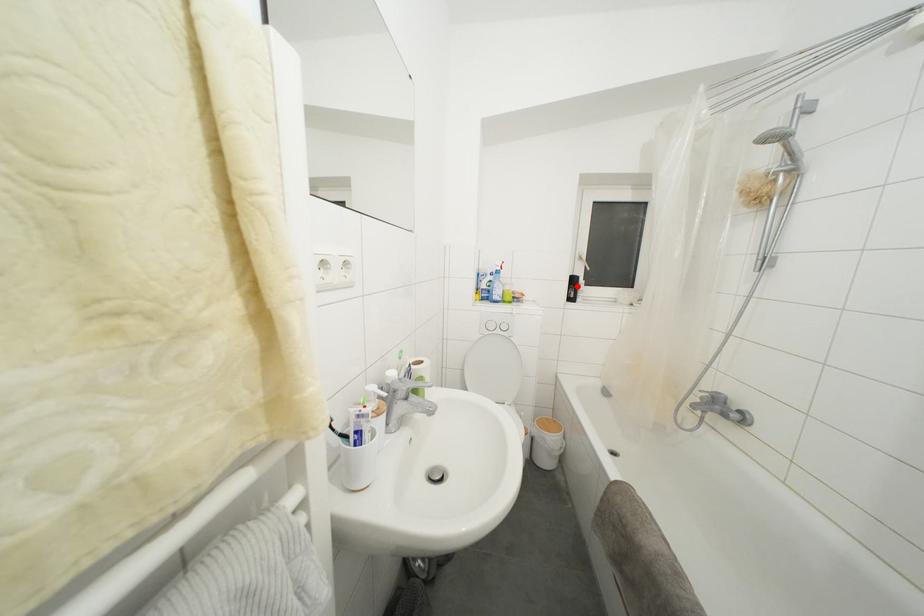
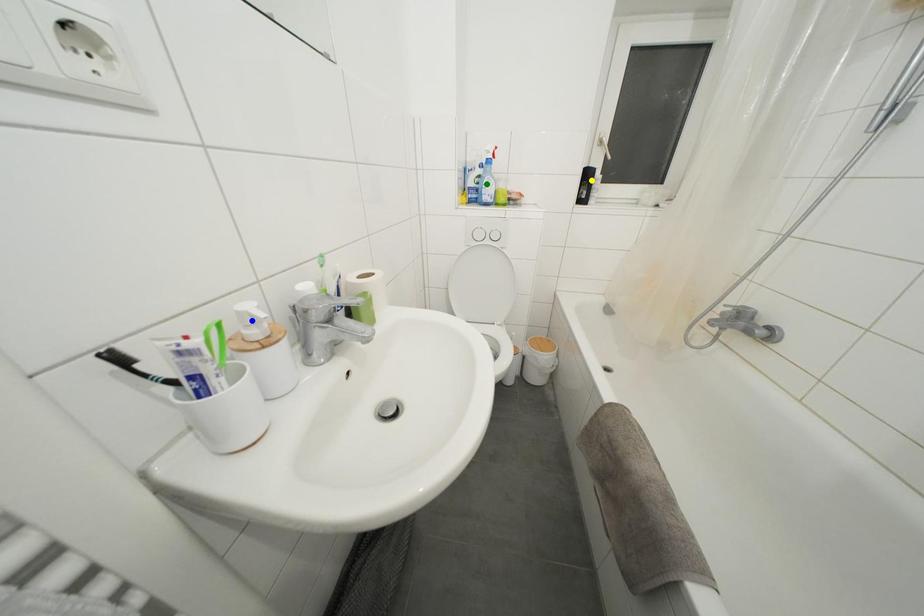
Question: I am providing you with two images of the same scene from different viewpoints. A red point is marked on the first image. You are given multiple points on the second image. Which point in image 2 is actually the same real-world point as the red point in image 1?

Choices:
 (A) green point
 (B) yellow point
 (C) blue point

Answer: (B)